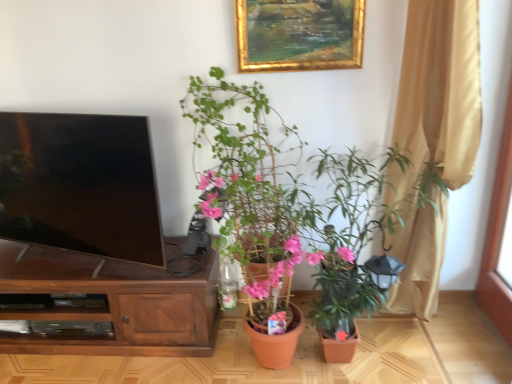
The width and height of the screenshot is (512, 384). Describe the element at coordinates (292, 213) in the screenshot. I see `matte terracotta pot at center, marked as the 2th houseplant in a right-to-left arrangement` at that location.

Find the location of a particular element. brown wood cabinet at left is located at coordinates (110, 303).

This screenshot has height=384, width=512. Describe the element at coordinates (80, 184) in the screenshot. I see `matte black tv at left` at that location.

I want to click on matte terracotta pot at center, acting as the first houseplant starting from the left, so click(292, 213).

From the image's perspective, is brown wood cabinet at left on gold/gilded picture frame at upper center?

Incorrect, from the image's perspective, brown wood cabinet at left is lower than gold/gilded picture frame at upper center.

Does point (40, 314) lie in front of point (315, 38)?

That is False.

Consider the image. Which object is closer to the camera, brown wood cabinet at left or gold/gilded picture frame at upper center?

Positioned in front is gold/gilded picture frame at upper center.

Considering the relative sizes of beige fabric curtain at right and gold/gilded picture frame at upper center in the image provided, is beige fabric curtain at right shorter than gold/gilded picture frame at upper center?

No, beige fabric curtain at right is not shorter than gold/gilded picture frame at upper center.

From the image's perspective, who appears lower, beige fabric curtain at right or gold/gilded picture frame at upper center?

beige fabric curtain at right.

Is beige fabric curtain at right looking in the opposite direction of gold/gilded picture frame at upper center?

beige fabric curtain at right is not turned away from gold/gilded picture frame at upper center.

Which object is positioned more to the right, beige fabric curtain at right or gold/gilded picture frame at upper center?

beige fabric curtain at right.

From a real-world perspective, between green matte plant at lower right, acting as the second houseplant starting from the left, and matte terracotta pot at center, marked as the 2th houseplant in a right-to-left arrangement, who is vertically higher?

matte terracotta pot at center, marked as the 2th houseplant in a right-to-left arrangement.

Who is bigger, green matte plant at lower right, acting as the second houseplant starting from the left, or matte terracotta pot at center, marked as the 2th houseplant in a right-to-left arrangement?

With larger size is green matte plant at lower right, acting as the second houseplant starting from the left.

Is matte terracotta pot at center, marked as the 2th houseplant in a right-to-left arrangement, completely or partially inside green matte plant at lower right, marked as the 1th houseplant in a right-to-left arrangement?

Yes, green matte plant at lower right, marked as the 1th houseplant in a right-to-left arrangement, contains matte terracotta pot at center, marked as the 2th houseplant in a right-to-left arrangement.

Which point is more distant from viewer, (372,211) or (210,130)?

Point (210,130)

From the image's perspective, is matte terracotta pot at center, marked as the 2th houseplant in a right-to-left arrangement, located beneath green matte plant at lower right, marked as the 1th houseplant in a right-to-left arrangement?

No.

Consider the image. From a real-world perspective, is matte terracotta pot at center, acting as the first houseplant starting from the left, positioned over green matte plant at lower right, marked as the 1th houseplant in a right-to-left arrangement, based on gravity?

Correct, in the physical world, matte terracotta pot at center, acting as the first houseplant starting from the left, is higher than green matte plant at lower right, marked as the 1th houseplant in a right-to-left arrangement.

Is matte terracotta pot at center, marked as the 2th houseplant in a right-to-left arrangement, not inside green matte plant at lower right, marked as the 1th houseplant in a right-to-left arrangement?

Actually, matte terracotta pot at center, marked as the 2th houseplant in a right-to-left arrangement, is at least partially inside green matte plant at lower right, marked as the 1th houseplant in a right-to-left arrangement.

How many degrees apart are the facing directions of matte terracotta pot at center, acting as the first houseplant starting from the left, and green matte plant at lower right, marked as the 1th houseplant in a right-to-left arrangement?

3.4e-05 degrees separate the facing orientations of matte terracotta pot at center, acting as the first houseplant starting from the left, and green matte plant at lower right, marked as the 1th houseplant in a right-to-left arrangement.

Who is more distant, matte terracotta pot at center, acting as the first houseplant starting from the left, or brown wood cabinet at left?

Positioned behind is brown wood cabinet at left.

Between point (252, 236) and point (20, 348), which one is positioned in front?

The point (252, 236) is closer.

Is matte terracotta pot at center, acting as the first houseplant starting from the left, not inside brown wood cabinet at left?

Indeed, matte terracotta pot at center, acting as the first houseplant starting from the left, is completely outside brown wood cabinet at left.

Is matte terracotta pot at center, marked as the 2th houseplant in a right-to-left arrangement, not inside matte black tv at left?

Yes, matte terracotta pot at center, marked as the 2th houseplant in a right-to-left arrangement, is outside of matte black tv at left.

Does matte terracotta pot at center, acting as the first houseplant starting from the left, have a greater width compared to matte black tv at left?

Indeed, matte terracotta pot at center, acting as the first houseplant starting from the left, has a greater width compared to matte black tv at left.

Is matte terracotta pot at center, marked as the 2th houseplant in a right-to-left arrangement, not close to matte black tv at left?

matte terracotta pot at center, marked as the 2th houseplant in a right-to-left arrangement, is actually quite close to matte black tv at left.

How many degrees apart are the facing directions of matte terracotta pot at center, acting as the first houseplant starting from the left, and matte black tv at left?

There is a 18.1-degree angle between the facing directions of matte terracotta pot at center, acting as the first houseplant starting from the left, and matte black tv at left.

Is gold/gilded picture frame at upper center touching matte terracotta pot at center, marked as the 2th houseplant in a right-to-left arrangement?

No, gold/gilded picture frame at upper center is not with matte terracotta pot at center, marked as the 2th houseplant in a right-to-left arrangement.

Does gold/gilded picture frame at upper center have a larger size compared to matte terracotta pot at center, acting as the first houseplant starting from the left?

No, gold/gilded picture frame at upper center is not bigger than matte terracotta pot at center, acting as the first houseplant starting from the left.

Looking at this image, which of these two, gold/gilded picture frame at upper center or matte terracotta pot at center, marked as the 2th houseplant in a right-to-left arrangement, stands shorter?

gold/gilded picture frame at upper center is shorter.

Considering the positions of objects gold/gilded picture frame at upper center and matte terracotta pot at center, acting as the first houseplant starting from the left, in the image provided, who is behind, gold/gilded picture frame at upper center or matte terracotta pot at center, acting as the first houseplant starting from the left,?

gold/gilded picture frame at upper center.

Find the location of a particular element. This screenshot has height=384, width=512. picture frame on the right of brown wood cabinet at left is located at coordinates (298, 34).

This screenshot has height=384, width=512. I want to click on curtain that is below the gold/gilded picture frame at upper center (from the image's perspective), so click(438, 94).

Considering their positions, is green matte plant at lower right, marked as the 1th houseplant in a right-to-left arrangement, positioned further to gold/gilded picture frame at upper center than matte black tv at left?

matte black tv at left is positioned further to the anchor gold/gilded picture frame at upper center.

Based on the photo, which object lies nearer to the anchor point beige fabric curtain at right, matte terracotta pot at center, marked as the 2th houseplant in a right-to-left arrangement, or gold/gilded picture frame at upper center?

matte terracotta pot at center, marked as the 2th houseplant in a right-to-left arrangement, lies closer to beige fabric curtain at right than the other object.

From the picture: Estimate the real-world distances between objects in this image. Which object is further from matte terracotta pot at center, marked as the 2th houseplant in a right-to-left arrangement, brown wood cabinet at left or gold/gilded picture frame at upper center?

brown wood cabinet at left is positioned further to the anchor matte terracotta pot at center, marked as the 2th houseplant in a right-to-left arrangement.

Considering their positions, is beige fabric curtain at right positioned further to matte terracotta pot at center, marked as the 2th houseplant in a right-to-left arrangement, than brown wood cabinet at left?

brown wood cabinet at left lies further to matte terracotta pot at center, marked as the 2th houseplant in a right-to-left arrangement, than the other object.

Looking at this image, considering their positions, is gold/gilded picture frame at upper center positioned further to matte terracotta pot at center, marked as the 2th houseplant in a right-to-left arrangement, than beige fabric curtain at right?

gold/gilded picture frame at upper center lies further to matte terracotta pot at center, marked as the 2th houseplant in a right-to-left arrangement, than the other object.

Estimate the real-world distances between objects in this image. Which object is further from brown wood cabinet at left, beige fabric curtain at right or green matte plant at lower right, marked as the 1th houseplant in a right-to-left arrangement?

The object further to brown wood cabinet at left is beige fabric curtain at right.

Based on their spatial positions, is matte terracotta pot at center, acting as the first houseplant starting from the left, or green matte plant at lower right, acting as the second houseplant starting from the left, further from gold/gilded picture frame at upper center?

Based on the image, green matte plant at lower right, acting as the second houseplant starting from the left, appears to be further to gold/gilded picture frame at upper center.

When comparing their distances from matte black tv at left, does beige fabric curtain at right or matte terracotta pot at center, acting as the first houseplant starting from the left, seem closer?

matte terracotta pot at center, acting as the first houseplant starting from the left, is positioned closer to the anchor matte black tv at left.

Find the location of `houseplant between gold/gilded picture frame at upper center and green matte plant at lower right, acting as the second houseplant starting from the left, from top to bottom`. houseplant between gold/gilded picture frame at upper center and green matte plant at lower right, acting as the second houseplant starting from the left, from top to bottom is located at coordinates [292, 213].

Where is `curtain between gold/gilded picture frame at upper center and green matte plant at lower right, acting as the second houseplant starting from the left, in the up-down direction`? curtain between gold/gilded picture frame at upper center and green matte plant at lower right, acting as the second houseplant starting from the left, in the up-down direction is located at coordinates (438, 94).

You are a GUI agent. You are given a task and a screenshot of the screen. Output one action in this format:
    pyautogui.click(x=<x>, y=<y>)
    Task: Click on the picture frame between matte black tv at left and beige fabric curtain at right from left to right
    Image resolution: width=512 pixels, height=384 pixels.
    Given the screenshot: What is the action you would take?
    pyautogui.click(x=298, y=34)

Identify the location of curtain between gold/gilded picture frame at upper center and matte terracotta pot at center, acting as the first houseplant starting from the left, in the up-down direction. This screenshot has height=384, width=512. (438, 94).